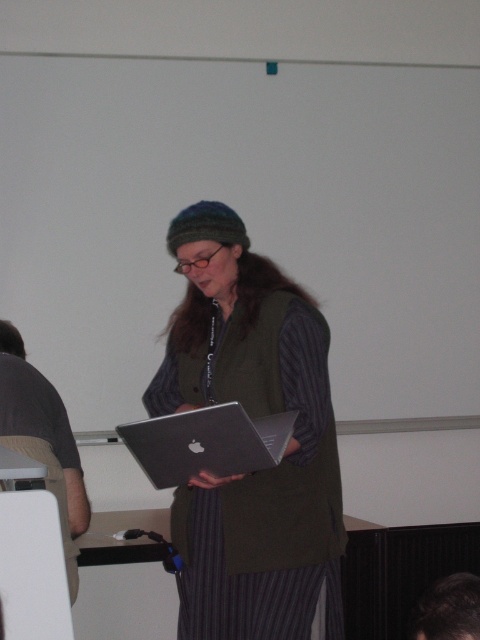
In the scene shown: You are a photographer in a classroom setting. You need to capture a clear photo of the matte silver laptop at center without any obstruction. However, the dark hair at lower right is blocking part of the laptop. How can you adjust your position to ensure the laptop is fully visible?

Since the matte silver laptop at center is positioned over the dark hair at lower right, you can move your camera position slightly upwards or to the side to avoid the hair blocking the laptop.

You are organizing a tech showcase event and need to place two laptops on a table. The laptops are the matte silver laptop at center and the silver metallic laptop at center. The table has a 10 inch wide space available. Can both laptops be placed side by side without overlapping?

The matte silver laptop at center and the silver metallic laptop at center are 6.81 inches apart, so they can be placed side by side on the 10 inch wide table since the combined distance between them is less than the available space.